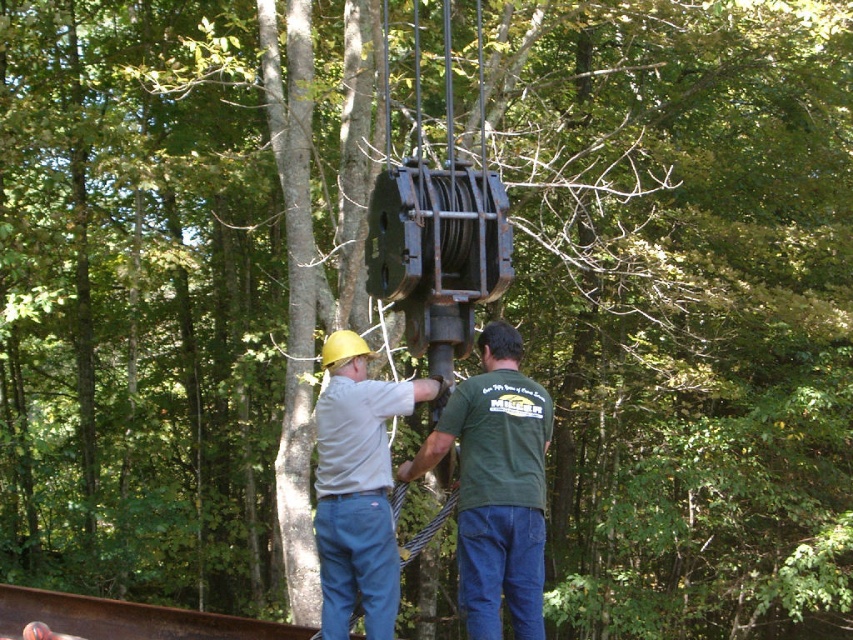
Is green matte shirt at center further to the viewer compared to matte yellow hard hat at center?

No, it is in front of matte yellow hard hat at center.

Is green matte shirt at center above matte yellow hard hat at center?

Indeed, green matte shirt at center is positioned over matte yellow hard hat at center.

Between point (518, 531) and point (389, 413), which one is positioned in front?

Positioned in front is point (518, 531).

This screenshot has height=640, width=853. Find the location of `green matte shirt at center`. green matte shirt at center is located at coordinates (496, 486).